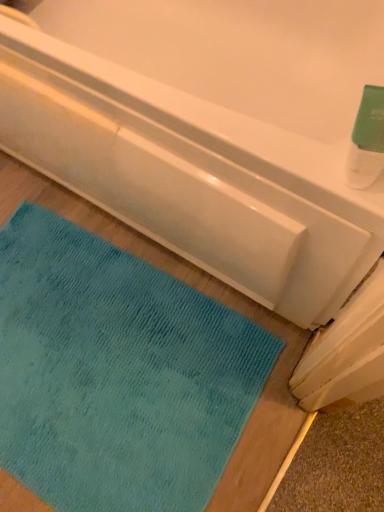
This screenshot has width=384, height=512. I want to click on vacant space underneath teal plush mat at lower left (from a real-world perspective), so click(95, 380).